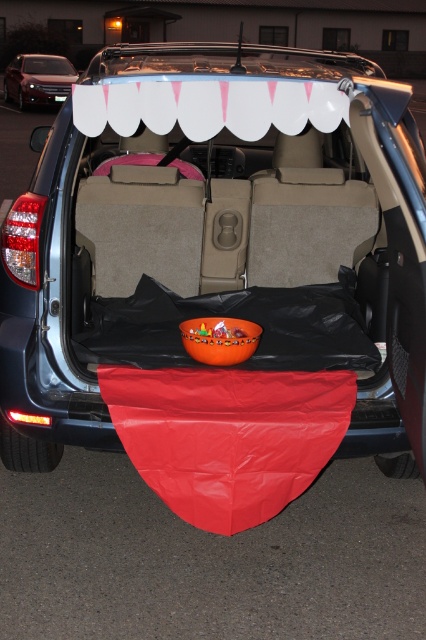
Question: Can you confirm if red matte blanket at lower center is positioned to the left of satin silver sedan at upper left?

Choices:
 (A) yes
 (B) no

Answer: (B)

Question: Can you confirm if red matte blanket at lower center is thinner than satin silver sedan at upper left?

Choices:
 (A) no
 (B) yes

Answer: (B)

Question: Which point is closer to the camera?

Choices:
 (A) satin silver sedan at upper left
 (B) red matte blanket at lower center

Answer: (B)

Question: Does red matte blanket at lower center have a smaller size compared to satin silver sedan at upper left?

Choices:
 (A) no
 (B) yes

Answer: (B)

Question: Which point is closer to the camera?

Choices:
 (A) (322, 384)
 (B) (77, 76)

Answer: (A)

Question: Which of the following is the farthest from the observer?

Choices:
 (A) (46, 70)
 (B) (256, 454)

Answer: (A)